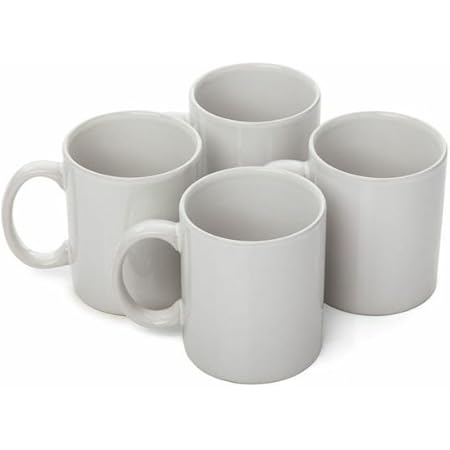
This screenshot has height=450, width=450. I want to click on mug handle, so click(x=11, y=201), click(x=180, y=118), click(x=284, y=163), click(x=141, y=236).